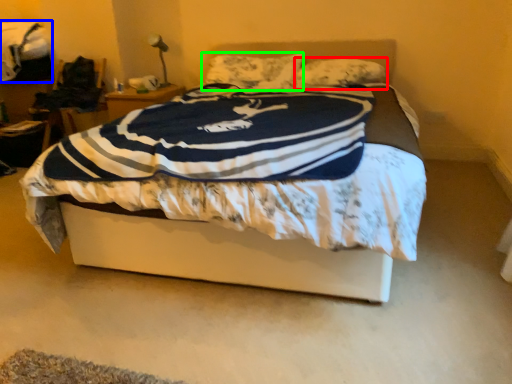
Question: Which object is positioned closest to pillow (highlighted by a red box)? Select from blanket (highlighted by a blue box) and pillow (highlighted by a green box).

Choices:
 (A) blanket
 (B) pillow

Answer: (B)